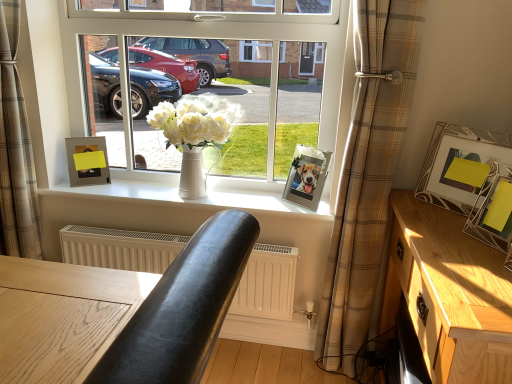
Find the location of a particular element. The image size is (512, 384). vacant area on top of white smooth vase at center (from a real-world perspective) is located at coordinates (167, 192).